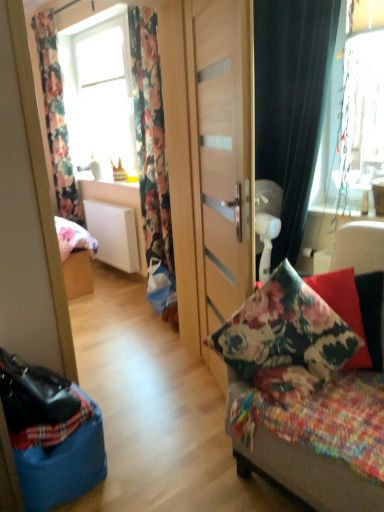
Question: Should I look upward or downward to see black velvet curtain at right, the 3th curtain positioned from the back?

Choices:
 (A) down
 (B) up

Answer: (B)

Question: Is transparent glass window at upper right, the second window when ordered from left to right, thinner than floral fabric cushion at center?

Choices:
 (A) yes
 (B) no

Answer: (A)

Question: Is transparent glass window at upper right, which ranks as the second window in back-to-front order, oriented away from floral fabric cushion at center?

Choices:
 (A) no
 (B) yes

Answer: (A)

Question: From a real-world perspective, is transparent glass window at upper right, which ranks as the second window in back-to-front order, located beneath floral fabric cushion at center?

Choices:
 (A) yes
 (B) no

Answer: (B)

Question: Is transparent glass window at upper right, the first window from the right, wider than floral fabric cushion at center?

Choices:
 (A) yes
 (B) no

Answer: (B)

Question: Can you confirm if transparent glass window at upper right, which ranks as the second window in back-to-front order, is smaller than floral fabric cushion at center?

Choices:
 (A) yes
 (B) no

Answer: (A)

Question: Considering the relative sizes of transparent glass window at upper right, the first window from the right, and floral fabric cushion at center in the image provided, is transparent glass window at upper right, the first window from the right, bigger than floral fabric cushion at center?

Choices:
 (A) no
 (B) yes

Answer: (A)

Question: Is floral fabric pillow at right taller than transparent glass window at upper right, which ranks as the second window in back-to-front order?

Choices:
 (A) no
 (B) yes

Answer: (A)

Question: Is floral fabric pillow at right further to camera compared to transparent glass window at upper right, the first window in the front-to-back sequence?

Choices:
 (A) no
 (B) yes

Answer: (A)

Question: Is floral fabric pillow at right closer to the viewer compared to transparent glass window at upper right, the first window in the front-to-back sequence?

Choices:
 (A) yes
 (B) no

Answer: (A)

Question: Is floral fabric pillow at right in contact with transparent glass window at upper right, the second window when ordered from left to right?

Choices:
 (A) yes
 (B) no

Answer: (B)

Question: Considering the relative positions of floral fabric pillow at right and transparent glass window at upper right, which ranks as the second window in back-to-front order, in the image provided, is floral fabric pillow at right to the left of transparent glass window at upper right, which ranks as the second window in back-to-front order, from the viewer's perspective?

Choices:
 (A) yes
 (B) no

Answer: (A)

Question: Can you confirm if floral fabric pillow at right is shorter than transparent glass window at upper right, which ranks as the second window in back-to-front order?

Choices:
 (A) yes
 (B) no

Answer: (A)

Question: Is there a large distance between floral fabric curtain at left, which is counted as the second curtain, starting from the right, and floral fabric cushion at center?

Choices:
 (A) no
 (B) yes

Answer: (B)